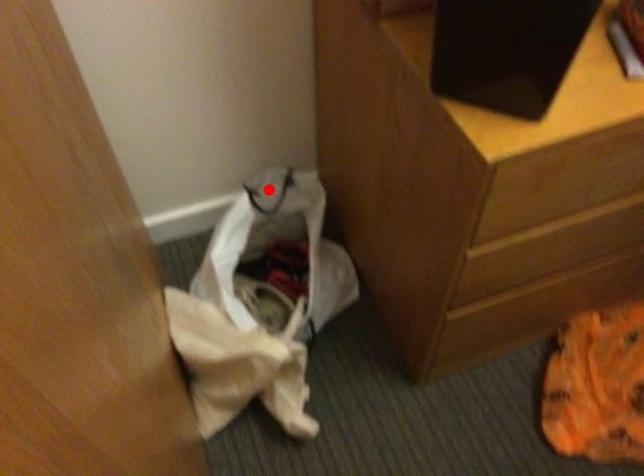
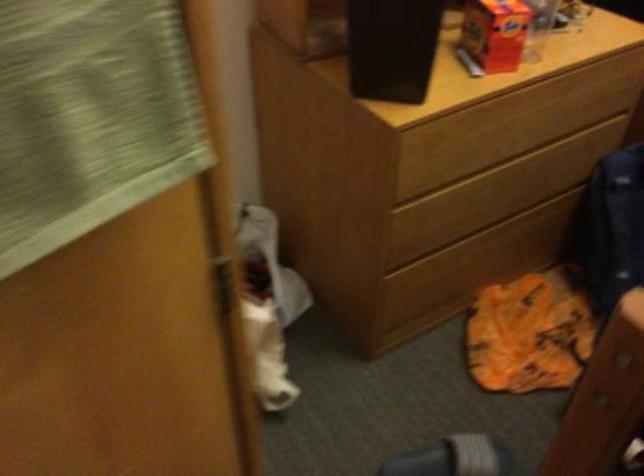
Question: I am providing you with two images of the same scene from different viewpoints. A red point is marked on the first image. At the location where the point appears in image 1, is it still visible in image 2?

Choices:
 (A) Yes
 (B) No

Answer: (B)